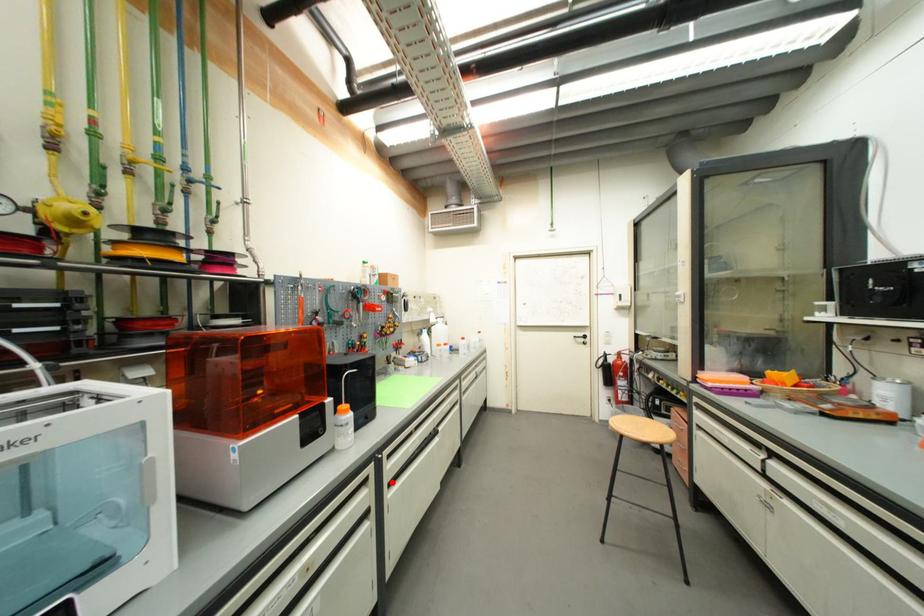
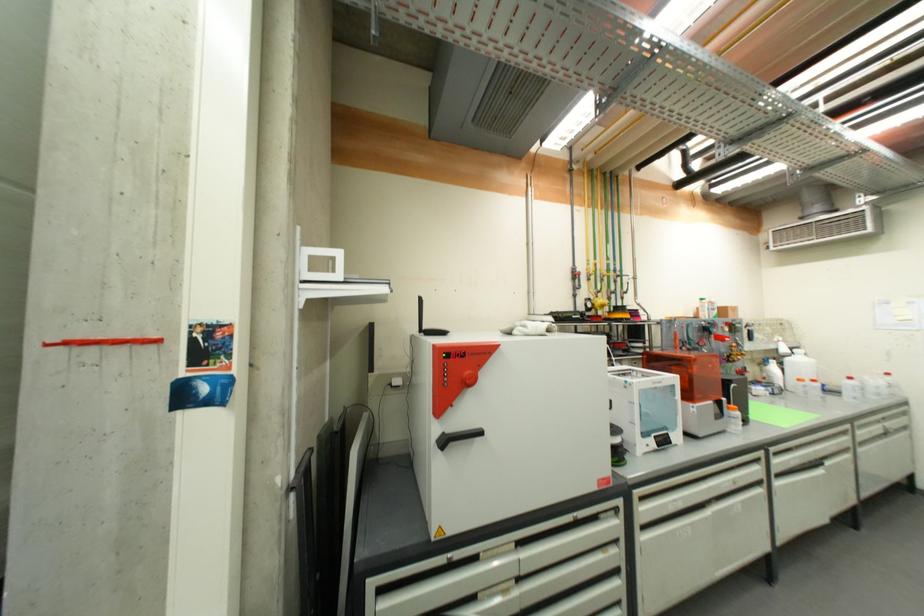
The point at the highlighted location is marked in the first image. Where is the corresponding point in the second image?

(779, 472)